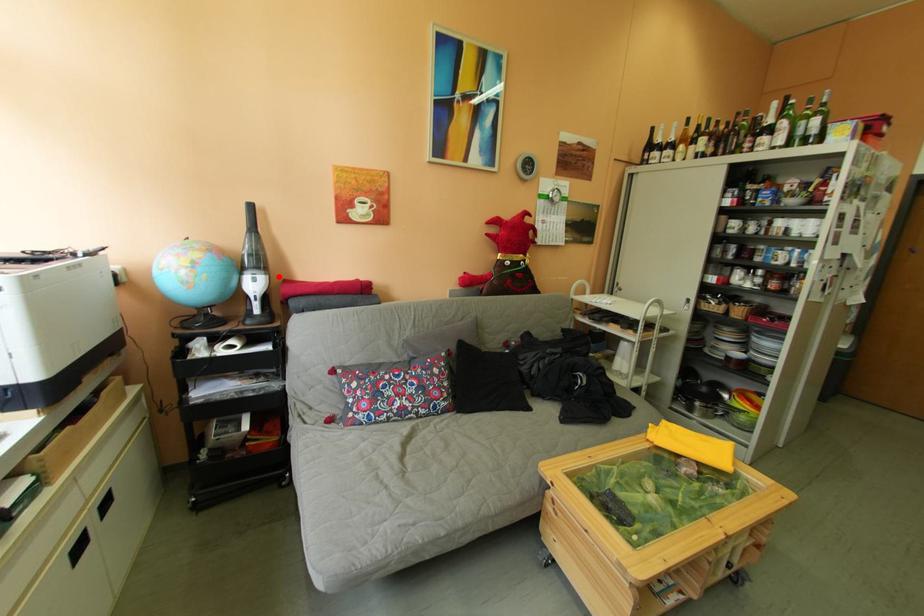
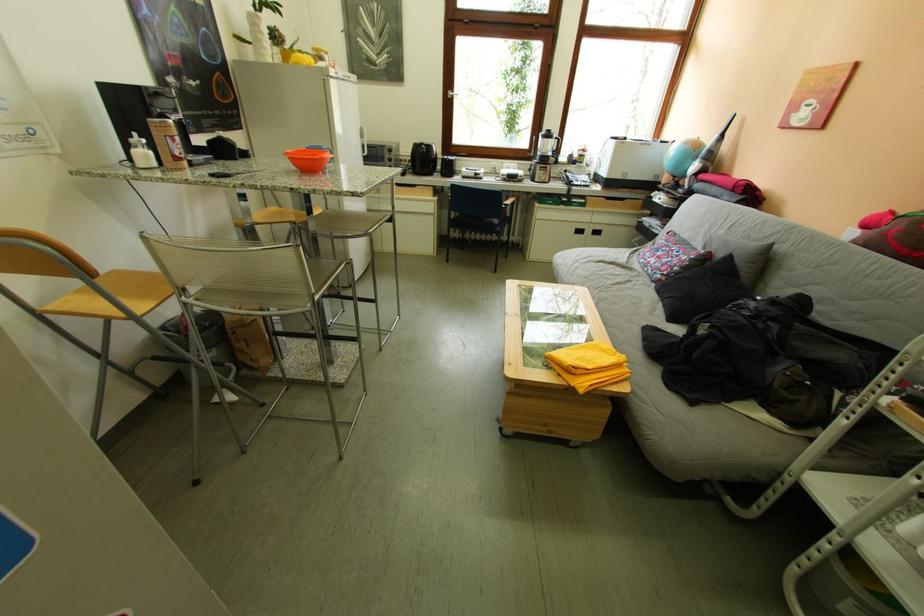
In the second image, find the point that corresponds to the highlighted location in the first image.

(713, 166)